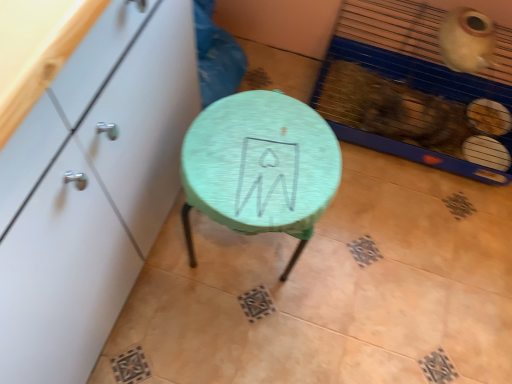
Where is `vacant area that lies to the right of mint green fabric stool at center`? The height and width of the screenshot is (384, 512). vacant area that lies to the right of mint green fabric stool at center is located at coordinates (352, 256).